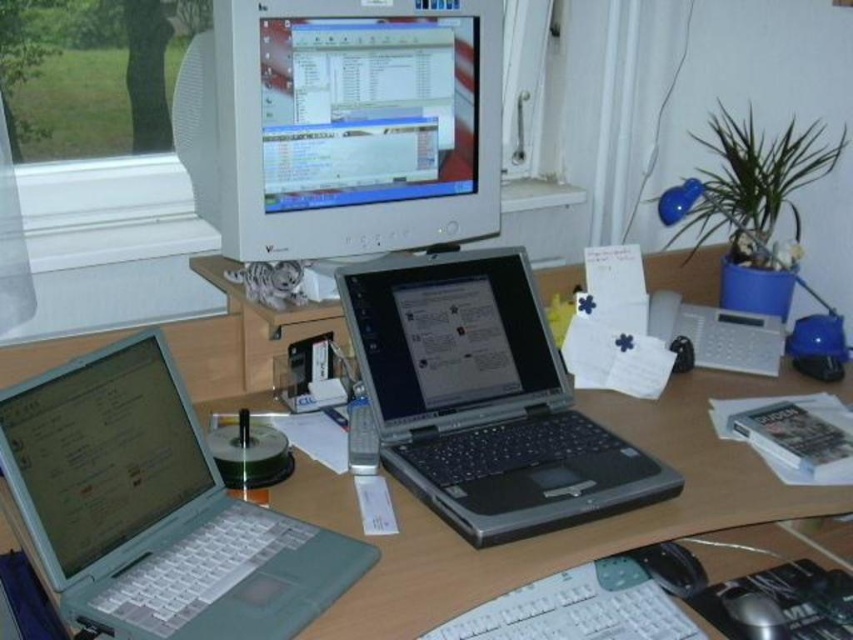
Which is more to the right, light gray plastic laptop at left or black plastic mouse at lower right?

From the viewer's perspective, black plastic mouse at lower right appears more on the right side.

Is light gray plastic laptop at left thinner than black plastic mouse at lower right?

No.

Where is `light gray plastic laptop at left`? This screenshot has height=640, width=853. light gray plastic laptop at left is located at coordinates (154, 509).

The height and width of the screenshot is (640, 853). In order to click on light gray plastic laptop at left in this screenshot , I will do `click(154, 509)`.

Where is `silver/black laptop at center`? This screenshot has height=640, width=853. silver/black laptop at center is located at coordinates (485, 400).

Who is more distant from viewer, (384, 394) or (730, 592)?

The point (384, 394) is more distant.

You are a GUI agent. You are given a task and a screenshot of the screen. Output one action in this format:
    pyautogui.click(x=<x>, y=<y>)
    Task: Click on the silver/black laptop at center
    This screenshot has width=853, height=640.
    Given the screenshot: What is the action you would take?
    (485, 400)

Does point (496, 307) come in front of point (643, 440)?

No.

Which is behind, point (469, 522) or point (680, 516)?

Positioned behind is point (680, 516).

This screenshot has width=853, height=640. What do you see at coordinates (485, 400) in the screenshot?
I see `silver/black laptop at center` at bounding box center [485, 400].

Where is `silver/black laptop at center`? The height and width of the screenshot is (640, 853). silver/black laptop at center is located at coordinates (485, 400).